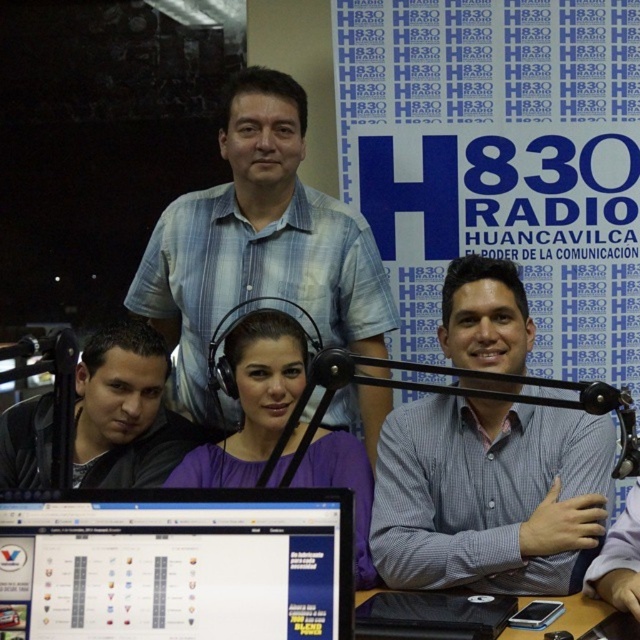
You are a guest on the radio show and need to place your personal item, the black leather jacket at lower left, next to the metallic black microphone at right on the desk. Considering their sizes, will the jacket fit comfortably next to the microphone without overcrowding the space?

The black leather jacket at lower left is bigger than the metallic black microphone at right, so placing the jacket next to the microphone may cause overcrowding due to the jacket taking up more space.

You are a guest on the radio show and need to adjust your microphone. The host tells you to move closer to the matte black monitor at lower left. Which object should you avoid moving past to stay near the blue plaid shirt at center?

You should avoid moving past the blue plaid shirt at center because the matte black monitor at lower left is smaller than the blue plaid shirt at center, indicating the shirt is closer to you. Moving past the shirt would take you away from the monitor.

Based on the photo, you are a guest speaker standing at the point marked as point [320,588]. You need to reach the microphone closest to you. Which microphone is it?

The microphone closest to point [320,588] is the one located at the desk, as the distance between them is 1.19 meters.